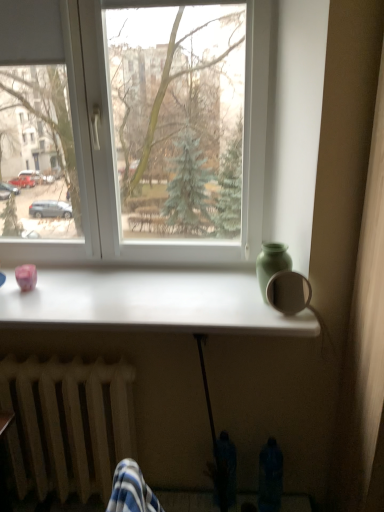
Locate an element on the screen. The height and width of the screenshot is (512, 384). vacant area on the back side of green matte vase at upper right is located at coordinates (250, 284).